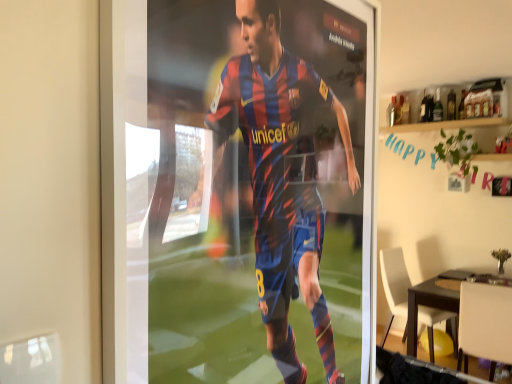
Question: Considering the relative positions of white plastic chair at lower right, arranged as the first chair when viewed from the back, and white matte chair at lower right, which appears as the first chair when viewed from the front, in the image provided, is white plastic chair at lower right, arranged as the first chair when viewed from the back, to the left or to the right of white matte chair at lower right, which appears as the first chair when viewed from the front,?

Choices:
 (A) left
 (B) right

Answer: (A)

Question: Is white plastic chair at lower right, the 2th chair from the front, bigger or smaller than white matte chair at lower right, which appears as the first chair when viewed from the front?

Choices:
 (A) big
 (B) small

Answer: (A)

Question: Considering the real-world distances, which object is farthest from the white matte chair at lower right, which ranks as the 2th chair in back-to-front order?

Choices:
 (A) white plastic chair at lower right, arranged as the first chair when viewed from the back
 (B) dark brown wooden table at lower right

Answer: (A)

Question: Based on their relative distances, which object is nearer to the white matte chair at lower right, which ranks as the 2th chair in back-to-front order?

Choices:
 (A) white plastic chair at lower right, the 2th chair from the front
 (B) dark brown wooden table at lower right

Answer: (B)